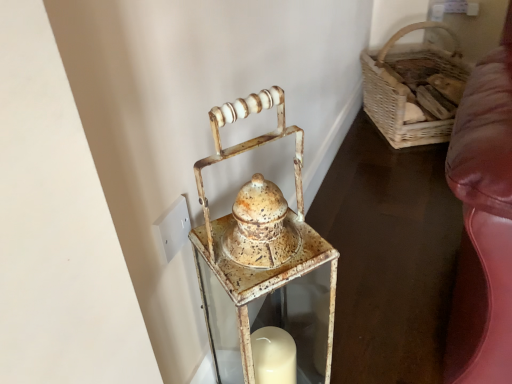
Question: Considering the relative positions of rusty metal lantern at center and woven wood basket at right in the image provided, is rusty metal lantern at center to the left or to the right of woven wood basket at right?

Choices:
 (A) left
 (B) right

Answer: (A)

Question: Is rusty metal lantern at center in front of or behind woven wood basket at right in the image?

Choices:
 (A) behind
 (B) front

Answer: (B)

Question: Is rusty metal lantern at center taller or shorter than woven wood basket at right?

Choices:
 (A) tall
 (B) short

Answer: (A)

Question: In terms of size, does woven wood basket at right appear bigger or smaller than rusty metal lantern at center?

Choices:
 (A) small
 (B) big

Answer: (B)

Question: Is woven wood basket at right in front of or behind rusty metal lantern at center in the image?

Choices:
 (A) front
 (B) behind

Answer: (B)

Question: Is woven wood basket at right to the left or to the right of rusty metal lantern at center in the image?

Choices:
 (A) left
 (B) right

Answer: (B)

Question: From their relative heights in the image, would you say woven wood basket at right is taller or shorter than rusty metal lantern at center?

Choices:
 (A) tall
 (B) short

Answer: (B)